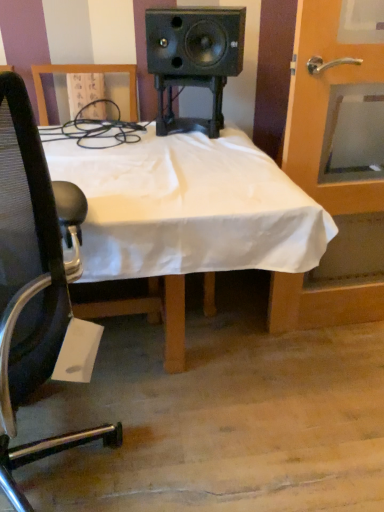
Question: Is black mesh chair at left to the right of white cloth-covered desk at center from the viewer's perspective?

Choices:
 (A) no
 (B) yes

Answer: (A)

Question: From the image's perspective, is black mesh chair at left located beneath white cloth-covered desk at center?

Choices:
 (A) no
 (B) yes

Answer: (B)

Question: Does black mesh chair at left have a lesser width compared to white cloth-covered desk at center?

Choices:
 (A) yes
 (B) no

Answer: (A)

Question: Is black mesh chair at left bigger than white cloth-covered desk at center?

Choices:
 (A) yes
 (B) no

Answer: (B)

Question: From the image's perspective, is black mesh chair at left over white cloth-covered desk at center?

Choices:
 (A) no
 (B) yes

Answer: (A)

Question: Does black mesh chair at left appear on the left side of white cloth-covered desk at center?

Choices:
 (A) yes
 (B) no

Answer: (A)

Question: Is the position of black mesh chair at left less distant than that of wooden door at right?

Choices:
 (A) no
 (B) yes

Answer: (B)

Question: From a real-world perspective, is black mesh chair at left physically below wooden door at right?

Choices:
 (A) yes
 (B) no

Answer: (A)

Question: Considering the relative sizes of black mesh chair at left and wooden door at right in the image provided, is black mesh chair at left taller than wooden door at right?

Choices:
 (A) no
 (B) yes

Answer: (A)

Question: Is black mesh chair at left positioned with its back to wooden door at right?

Choices:
 (A) yes
 (B) no

Answer: (B)

Question: Could you tell me if black mesh chair at left is turned towards wooden door at right?

Choices:
 (A) no
 (B) yes

Answer: (A)

Question: From a real-world perspective, is black mesh chair at left over wooden door at right?

Choices:
 (A) yes
 (B) no

Answer: (B)

Question: From the image's perspective, would you say white cloth-covered desk at center is shown under wooden door at right?

Choices:
 (A) yes
 (B) no

Answer: (A)